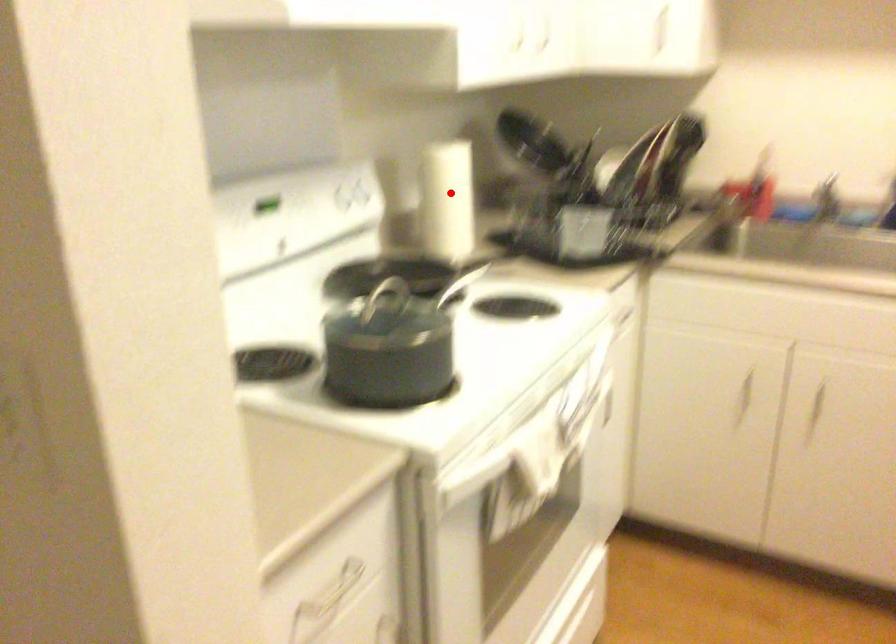
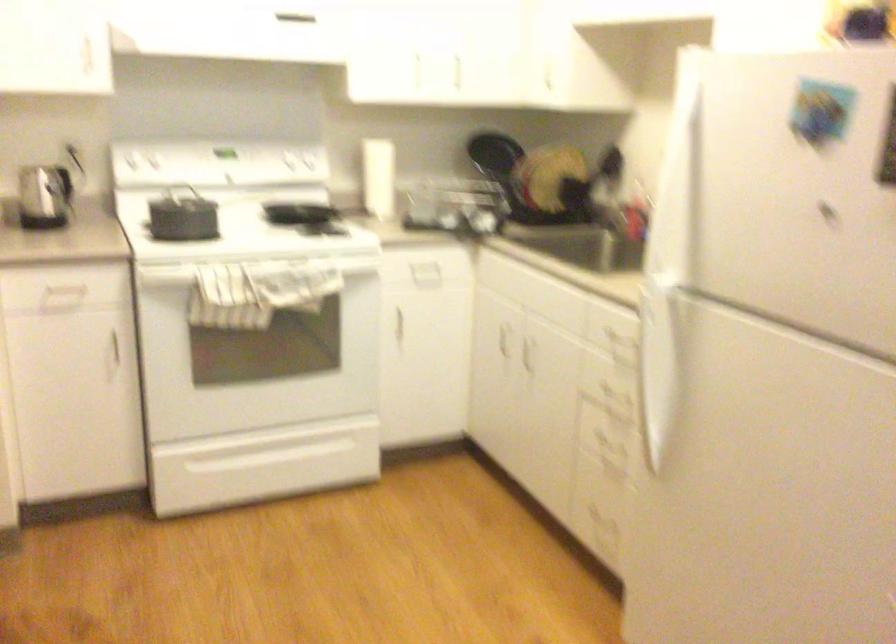
Find the pixel in the second image that matches the highlighted location in the first image.

(377, 178)